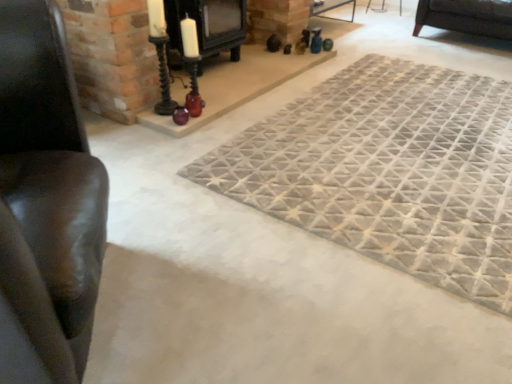
Question: Considering the relative sizes of black matte fireplace at upper center and leather couch at left in the image provided, is black matte fireplace at upper center shorter than leather couch at left?

Choices:
 (A) yes
 (B) no

Answer: (A)

Question: Is black matte fireplace at upper center facing towards leather couch at left?

Choices:
 (A) yes
 (B) no

Answer: (B)

Question: Is there a large distance between black matte fireplace at upper center and leather couch at left?

Choices:
 (A) yes
 (B) no

Answer: (A)

Question: From the image's perspective, is black matte fireplace at upper center above leather couch at left?

Choices:
 (A) yes
 (B) no

Answer: (A)

Question: Would you say black matte fireplace at upper center contains leather couch at left?

Choices:
 (A) yes
 (B) no

Answer: (B)

Question: Choose the correct answer: Is black matte fireplace at upper center inside textured gray mat at center or outside it?

Choices:
 (A) outside
 (B) inside

Answer: (A)

Question: Would you say black matte fireplace at upper center is to the left or to the right of textured gray mat at center in the picture?

Choices:
 (A) right
 (B) left

Answer: (B)

Question: Based on their sizes in the image, would you say black matte fireplace at upper center is bigger or smaller than textured gray mat at center?

Choices:
 (A) big
 (B) small

Answer: (B)

Question: Is black matte fireplace at upper center in front of or behind textured gray mat at center in the image?

Choices:
 (A) front
 (B) behind

Answer: (B)

Question: Is textured gray mat at center situated inside black matte fireplace at upper center or outside?

Choices:
 (A) inside
 (B) outside

Answer: (B)

Question: Considering the relative positions of textured gray mat at center and black matte fireplace at upper center in the image provided, is textured gray mat at center to the left or to the right of black matte fireplace at upper center?

Choices:
 (A) left
 (B) right

Answer: (B)

Question: Considering the positions of textured gray mat at center and black matte fireplace at upper center in the image, is textured gray mat at center wider or thinner than black matte fireplace at upper center?

Choices:
 (A) wide
 (B) thin

Answer: (A)

Question: In the image, is textured gray mat at center positioned in front of or behind black matte fireplace at upper center?

Choices:
 (A) front
 (B) behind

Answer: (A)

Question: Is textured gray mat at center spatially inside leather couch at left, or outside of it?

Choices:
 (A) outside
 (B) inside

Answer: (A)

Question: From the image's perspective, is textured gray mat at center located above or below leather couch at left?

Choices:
 (A) above
 (B) below

Answer: (A)